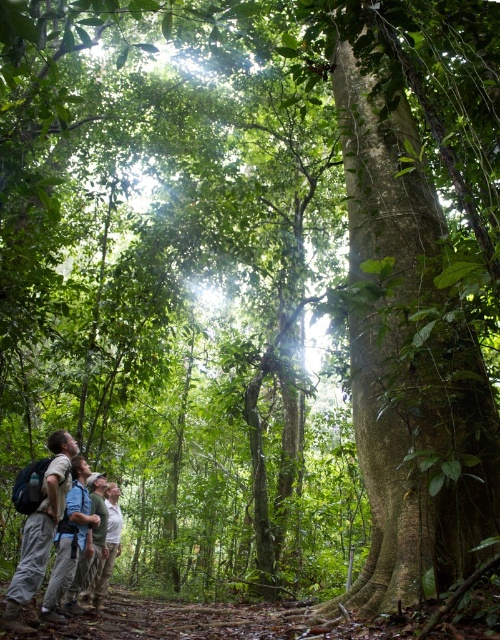
You are one of the individuals in the tropical forest scene. You need to carry an extra water bottle. Which item, the light brown backpack at lower left or the light gray shirt at lower center, is more suitable for holding the water bottle based on their sizes?

The light gray shirt at lower center is more suitable for holding the water bottle because the light brown backpack at lower left has a smaller size compared to it.

You are standing on the narrow leaf covered path in the dense tropical forest. You see two points marked in the scene. Which point is closer to you, point (31,540) or point (110,570)?

Point (31,540) is closer to the viewer than point (110,570).